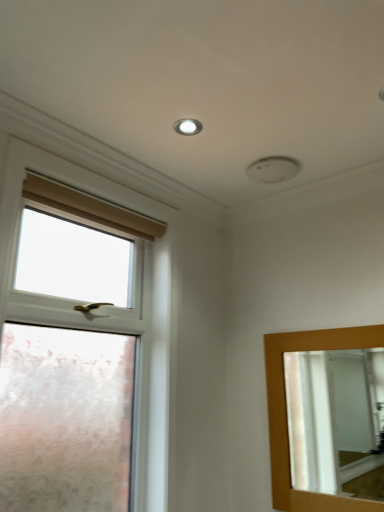
Question: Is wooden-framed mirror at right taller than white frosted glass window at left?

Choices:
 (A) yes
 (B) no

Answer: (B)

Question: From a real-world perspective, is wooden-framed mirror at right over white frosted glass window at left?

Choices:
 (A) no
 (B) yes

Answer: (A)

Question: Is wooden-framed mirror at right turned away from white frosted glass window at left?

Choices:
 (A) no
 (B) yes

Answer: (A)

Question: Does wooden-framed mirror at right contain white frosted glass window at left?

Choices:
 (A) yes
 (B) no

Answer: (B)

Question: Does wooden-framed mirror at right lie behind white frosted glass window at left?

Choices:
 (A) no
 (B) yes

Answer: (B)

Question: From the image's perspective, is wooden-framed mirror at right above or below matte white droplight at upper center?

Choices:
 (A) below
 (B) above

Answer: (A)

Question: Is wooden-framed mirror at right in front of or behind matte white droplight at upper center in the image?

Choices:
 (A) behind
 (B) front

Answer: (B)

Question: Based on their sizes in the image, would you say wooden-framed mirror at right is bigger or smaller than matte white droplight at upper center?

Choices:
 (A) small
 (B) big

Answer: (B)

Question: Would you say wooden-framed mirror at right is to the left or to the right of matte white droplight at upper center in the picture?

Choices:
 (A) left
 (B) right

Answer: (B)

Question: From their relative heights in the image, would you say matte white droplight at upper center is taller or shorter than wooden-framed mirror at right?

Choices:
 (A) short
 (B) tall

Answer: (A)

Question: In the image, is matte white droplight at upper center positioned in front of or behind wooden-framed mirror at right?

Choices:
 (A) behind
 (B) front

Answer: (A)

Question: From the image's perspective, is matte white droplight at upper center positioned above or below wooden-framed mirror at right?

Choices:
 (A) below
 (B) above

Answer: (B)

Question: Is matte white droplight at upper center wider or thinner than wooden-framed mirror at right?

Choices:
 (A) wide
 (B) thin

Answer: (A)

Question: Relative to white frosted glass window at left, is wooden-framed mirror at right in front or behind?

Choices:
 (A) front
 (B) behind

Answer: (B)

Question: Looking at the image, does wooden-framed mirror at right seem bigger or smaller compared to white frosted glass window at left?

Choices:
 (A) big
 (B) small

Answer: (B)